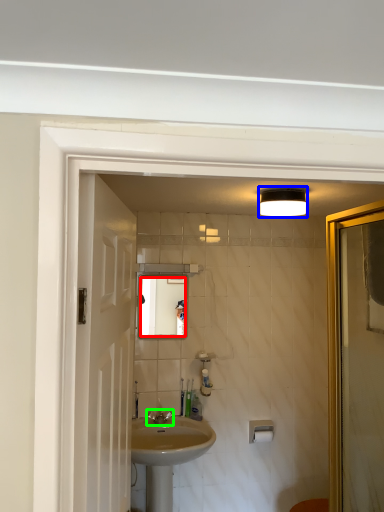
Question: Based on their relative distances, which object is nearer to mirror (highlighted by a red box)? Choose from light fixture (highlighted by a blue box) and tap (highlighted by a green box).

Choices:
 (A) light fixture
 (B) tap

Answer: (B)